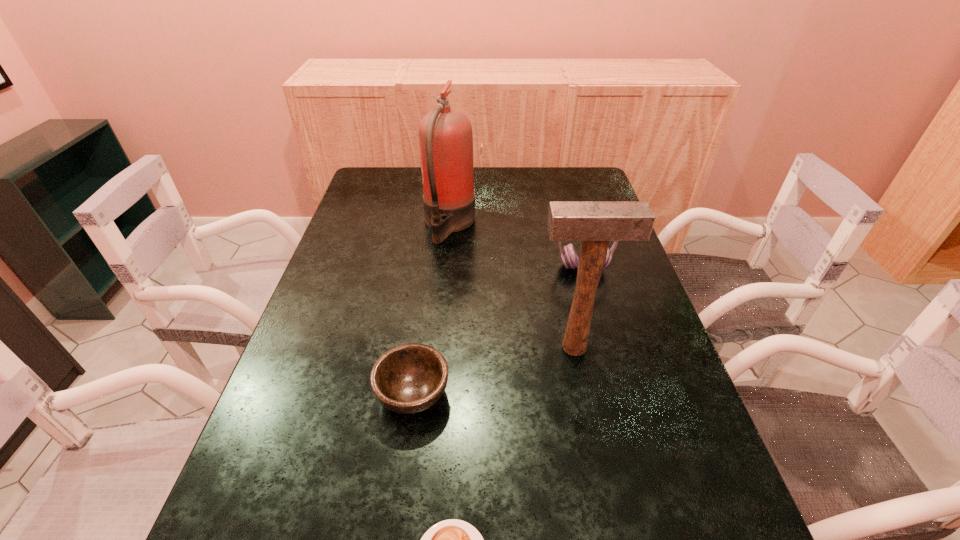
At what (x,y) coordinates should I click in order to perform the action: click on vacant space that's between the third nearest object and the farthest object. Please return your answer as a coordinate pair (x, y). This screenshot has height=540, width=960. Looking at the image, I should click on (512, 286).

At what (x,y) coordinates should I click in order to perform the action: click on unoccupied position between the second farthest object and the farthest object. Please return your answer as a coordinate pair (x, y). The width and height of the screenshot is (960, 540). Looking at the image, I should click on (516, 245).

Identify which object is located as the fourth nearest to the farthest object. Please provide its 2D coordinates. Your answer should be formatted as a tuple, i.e. [(x, y)], where the tuple contains the x and y coordinates of a point satisfying the conditions above.

[(452, 539)]

Select which object appears as the closest to the fire extinguisher. Please provide its 2D coordinates. Your answer should be formatted as a tuple, i.e. [(x, y)], where the tuple contains the x and y coordinates of a point satisfying the conditions above.

[(569, 256)]

This screenshot has width=960, height=540. Find the location of `vacant space that satisfies the following two spatial constraints: 1. on the back side of the third farthest object; 2. at the nozzle of the farthest object`. vacant space that satisfies the following two spatial constraints: 1. on the back side of the third farthest object; 2. at the nozzle of the farthest object is located at coordinates (548, 224).

Locate an element on the screen. This screenshot has height=540, width=960. vacant region that satisfies the following two spatial constraints: 1. on the back side of the fourth tallest object; 2. on the left side of the third nearest object is located at coordinates (420, 347).